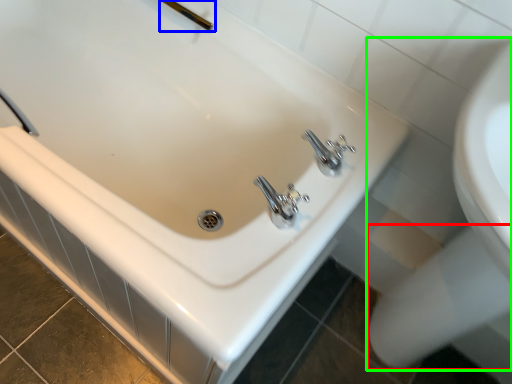
Question: Which object is positioned farthest from bidet (highlighted by a red box)? Select from shower (highlighted by a blue box) and sink (highlighted by a green box).

Choices:
 (A) shower
 (B) sink

Answer: (A)